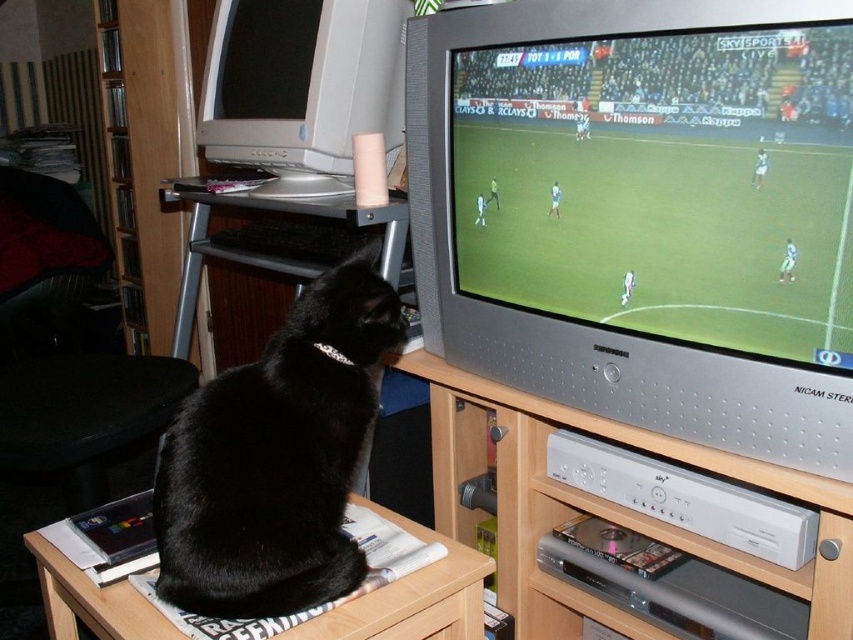
Which is in front, point (546, 609) or point (119, 628)?

Point (119, 628) is in front.

You are a GUI agent. You are given a task and a screenshot of the screen. Output one action in this format:
    pyautogui.click(x=<x>, y=<y>)
    Task: Click on the wooden entertainment center at lower center
    
    Given the screenshot: What is the action you would take?
    pyautogui.click(x=601, y=506)

Can you confirm if black fur cat at lower left is shorter than wooden table at lower left?

No, black fur cat at lower left is not shorter than wooden table at lower left.

Can you confirm if black fur cat at lower left is positioned to the right of wooden table at lower left?

Yes, black fur cat at lower left is to the right of wooden table at lower left.

Between point (247, 570) and point (138, 600), which one is positioned behind?

Positioned behind is point (138, 600).

Image resolution: width=853 pixels, height=640 pixels. What are the coordinates of `black fur cat at lower left` in the screenshot? It's located at (277, 458).

Between point (312, 504) and point (515, 476), which one is positioned in front?

Point (312, 504)

Who is positioned more to the left, black fur cat at lower left or wooden entertainment center at lower center?

From the viewer's perspective, black fur cat at lower left appears more on the left side.

Is point (231, 598) farther from viewer compared to point (524, 515)?

No, (231, 598) is in front of (524, 515).

Locate an element on the screen. black fur cat at lower left is located at coordinates (277, 458).